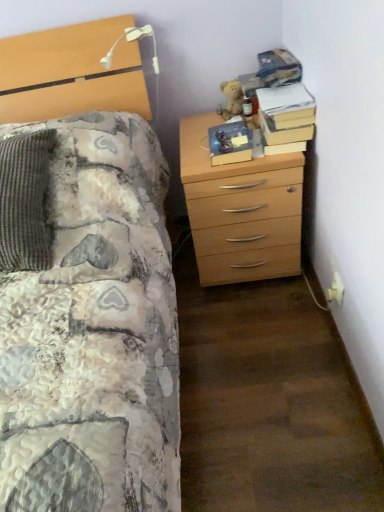
Question: Is the depth of hardcover book at center, which is the first book in left-to-right order, greater than that of hardcover book at upper right, positioned as the 2th book in left-to-right order?

Choices:
 (A) no
 (B) yes

Answer: (B)

Question: Is hardcover book at center, which is the first book in left-to-right order, positioned in front of hardcover book at upper right, which appears as the first book when viewed from the right?

Choices:
 (A) yes
 (B) no

Answer: (B)

Question: Is hardcover book at center, the second book in the right-to-left sequence, at the left side of hardcover book at upper right, positioned as the 2th book in left-to-right order?

Choices:
 (A) yes
 (B) no

Answer: (A)

Question: Is hardcover book at center, the second book in the right-to-left sequence, oriented towards hardcover book at upper right, which appears as the first book when viewed from the right?

Choices:
 (A) yes
 (B) no

Answer: (B)

Question: Is hardcover book at center, which is the first book in left-to-right order, located outside hardcover book at upper right, positioned as the 2th book in left-to-right order?

Choices:
 (A) no
 (B) yes

Answer: (B)

Question: From the image's perspective, is hardcover book at center, which is the first book in left-to-right order, on top of hardcover book at upper right, which appears as the first book when viewed from the right?

Choices:
 (A) no
 (B) yes

Answer: (A)

Question: From a real-world perspective, is hardcover book at upper right, positioned as the 2th book in left-to-right order, physically below light wood chest of drawers at right?

Choices:
 (A) no
 (B) yes

Answer: (A)

Question: From the image's perspective, would you say hardcover book at upper right, positioned as the 2th book in left-to-right order, is shown under light wood chest of drawers at right?

Choices:
 (A) yes
 (B) no

Answer: (B)

Question: Is hardcover book at upper right, positioned as the 2th book in left-to-right order, positioned with its back to light wood chest of drawers at right?

Choices:
 (A) no
 (B) yes

Answer: (A)

Question: Is hardcover book at upper right, positioned as the 2th book in left-to-right order, bigger than light wood chest of drawers at right?

Choices:
 (A) no
 (B) yes

Answer: (A)

Question: Is hardcover book at upper right, positioned as the 2th book in left-to-right order, aimed at light wood chest of drawers at right?

Choices:
 (A) no
 (B) yes

Answer: (A)

Question: From the image's perspective, is hardcover book at upper right, which appears as the first book when viewed from the right, on light wood chest of drawers at right?

Choices:
 (A) yes
 (B) no

Answer: (A)

Question: Does fuzzy brown teddy bear at upper right have a larger size compared to white plastic electric outlet at lower right?

Choices:
 (A) no
 (B) yes

Answer: (B)